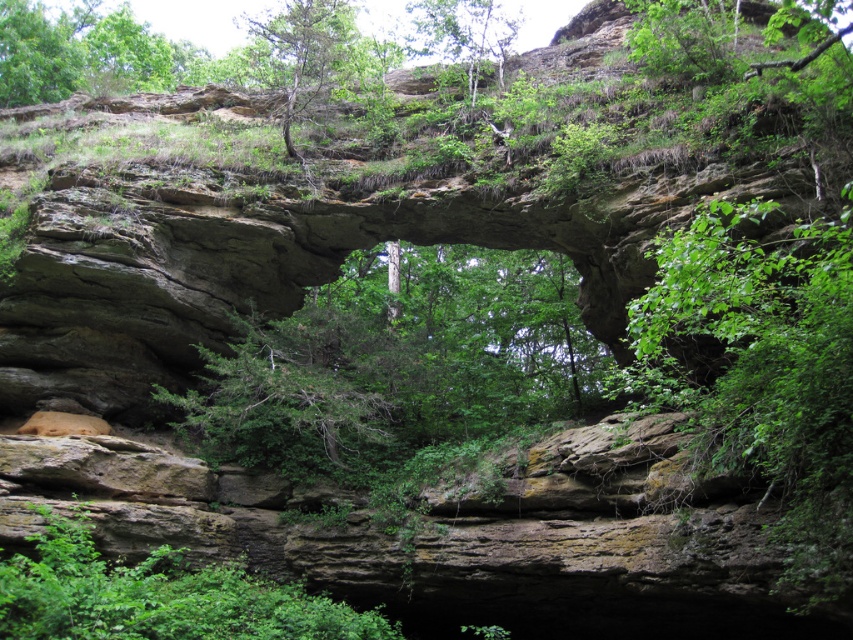
Question: Based on their relative distances, which object is farther from the green leafy tree at center?

Choices:
 (A) green leafy tree at upper center
 (B) green rough bark tree at upper center

Answer: (A)

Question: Which point is closer to the camera?

Choices:
 (A) (459, 52)
 (B) (343, 384)

Answer: (B)

Question: Does green leafy tree at center have a greater width compared to green leafy tree at upper center?

Choices:
 (A) yes
 (B) no

Answer: (A)

Question: Is green leafy tree at center smaller than green rough bark tree at upper center?

Choices:
 (A) yes
 (B) no

Answer: (A)

Question: Is green leafy tree at center bigger than green rough bark tree at upper center?

Choices:
 (A) no
 (B) yes

Answer: (A)

Question: Which point is farther from the camera taking this photo?

Choices:
 (A) (474, 13)
 (B) (178, 428)

Answer: (A)